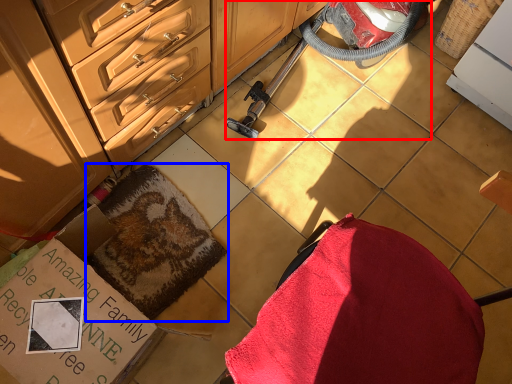
Question: Among these objects, which one is farthest to the camera, equipment (highlighted by a red box) or blanket (highlighted by a blue box)?

Choices:
 (A) equipment
 (B) blanket

Answer: (B)